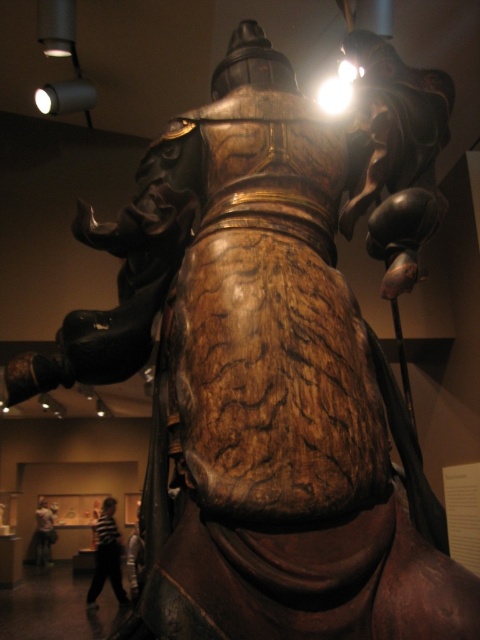
In the scene shown: You are an artist trying to sketch the statue and its surroundings. You notice two shirts hanging on a rack to the lower left of the statue. Which shirt has a greater width between the striped shirt at lower left and the white shirt at lower left?

The striped shirt at lower left has a greater width than the white shirt at lower left according to the description.

You are an art conservator examining the statue. You notice two points on the statue marked at coordinates point (120, 548) and point (49, 544). Which point is nearer to your viewpoint?

Point (120, 548) is closer to the camera than point (49, 544).

You are a security guard in a museum. You notice two shirts at the lower left of the statue. The striped shirt at lower left and the white shirt at lower left. You need to place a barrier between them to prevent visitors from touching the statue. The barrier is 25 inches wide. Will the barrier fit between the two shirts?

The distance between the striped shirt at lower left and white shirt at lower left is 27.23 inches. Since the barrier is 25 inches wide, it will fit between them as there is enough space.